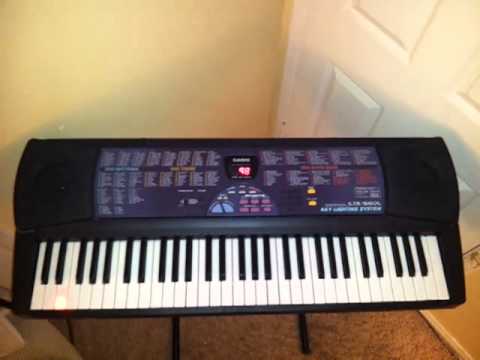
I want to click on carpet, so click(271, 334).